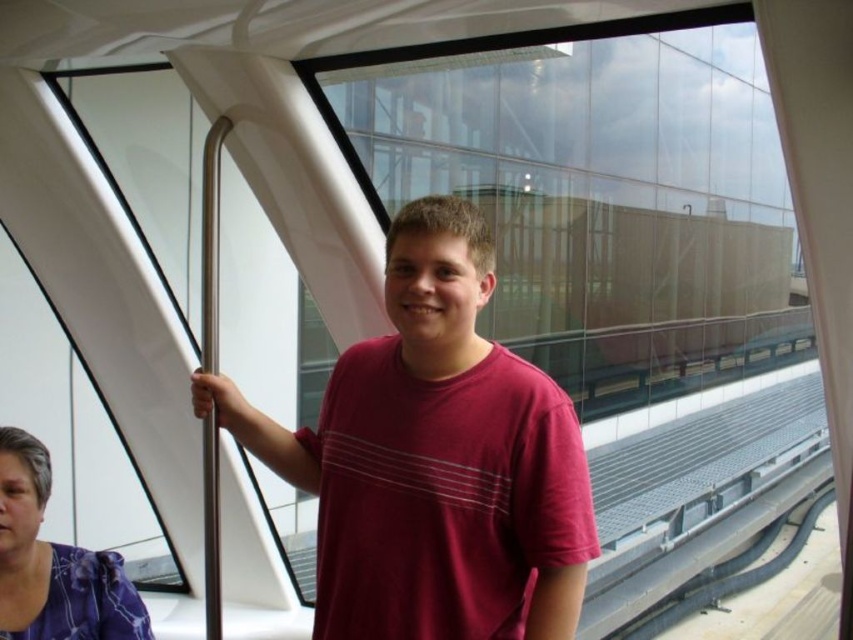
Is matte red t-shirt at center to the right of purple floral blouse at lower left from the viewer's perspective?

Correct, you'll find matte red t-shirt at center to the right of purple floral blouse at lower left.

Is point (555, 419) farther from camera compared to point (97, 561)?

No, (555, 419) is in front of (97, 561).

At what (x,y) coordinates should I click in order to perform the action: click on matte red t-shirt at center. Please return your answer as a coordinate pair (x, y). Looking at the image, I should click on (434, 460).